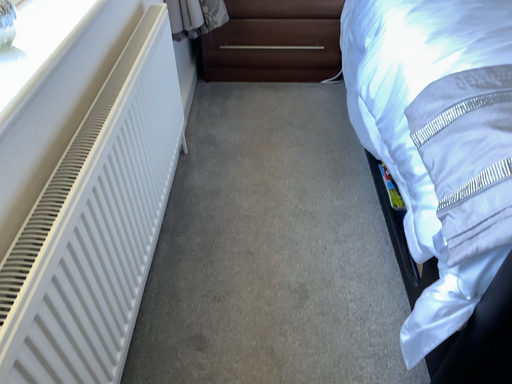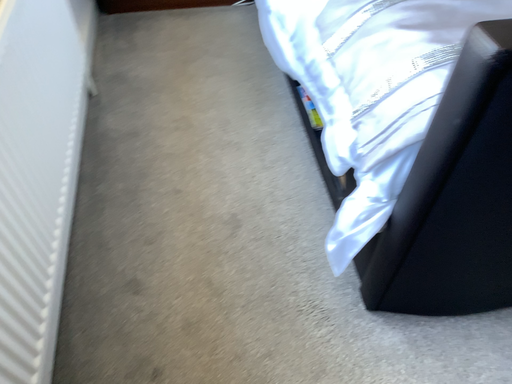
Question: How did the camera likely rotate when shooting the video?

Choices:
 (A) rotated downward
 (B) rotated upward

Answer: (A)